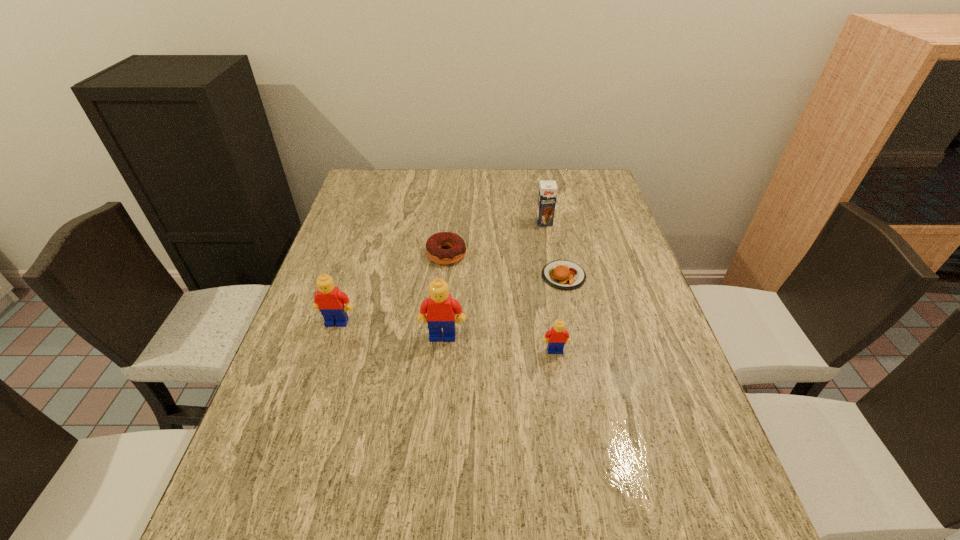
Where is `blank region between the second Lego from left to right and the nearest object`? Image resolution: width=960 pixels, height=540 pixels. blank region between the second Lego from left to right and the nearest object is located at coordinates (499, 343).

Select which object appears as the third closest to the farthest object. Please provide its 2D coordinates. Your answer should be formatted as a tuple, i.e. [(x, y)], where the tuple contains the x and y coordinates of a point satisfying the conditions above.

[(440, 308)]

This screenshot has height=540, width=960. I want to click on object that is the third nearest to the nearest object, so click(x=457, y=251).

At what (x,y) coordinates should I click in order to perform the action: click on the second closest Lego to the patty (food). Please return your answer as a coordinate pair (x, y). The width and height of the screenshot is (960, 540). Looking at the image, I should click on (440, 308).

Identify the location of Lego that stands as the closest to the second nearest object. (329, 300).

Locate an element on the screen. The image size is (960, 540). vacant space that satisfies the following two spatial constraints: 1. on the front label of the patty (food); 2. on the left side of the farthest object is located at coordinates (555, 275).

Locate an element on the screen. The height and width of the screenshot is (540, 960). free spot that satisfies the following two spatial constraints: 1. on the front label of the shortest object; 2. on the right side of the chocolate milk is located at coordinates pos(555,275).